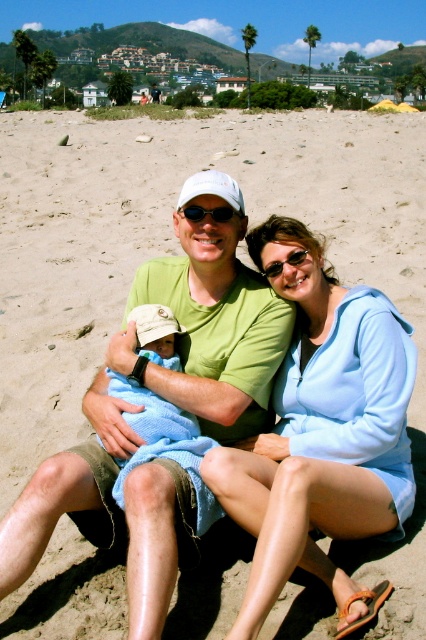
Is point (135, 368) closer to viewer compared to point (345, 464)?

That is False.

Who is more distant from viewer, (189, 337) or (282, 243)?

Point (189, 337)

Who is more distant from viewer, (178, 531) or (365, 400)?

The point (365, 400) is behind.

I want to click on green matte shirt at center, so click(x=166, y=400).

Which of these two, green matte shirt at center or blue knitted blanket at center, stands shorter?

blue knitted blanket at center

This screenshot has width=426, height=640. What are the coordinates of `green matte shirt at center` in the screenshot? It's located at (166, 400).

Can you confirm if light blue hoodie at center is thinner than blue knitted blanket at center?

No, light blue hoodie at center is not thinner than blue knitted blanket at center.

Does light blue hoodie at center have a larger size compared to blue knitted blanket at center?

Yes.

Is point (402, 358) positioned after point (189, 474)?

Yes, it is.

The image size is (426, 640). Find the location of `light blue hoodie at center`. light blue hoodie at center is located at coordinates (322, 433).